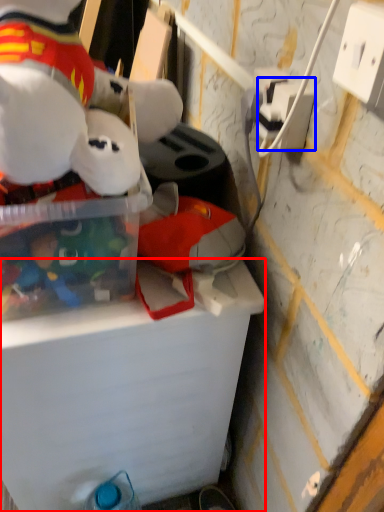
Question: Among these objects, which one is nearest to the camera, cardboard box (highlighted by a red box) or power outlet (highlighted by a blue box)?

Choices:
 (A) cardboard box
 (B) power outlet

Answer: (B)